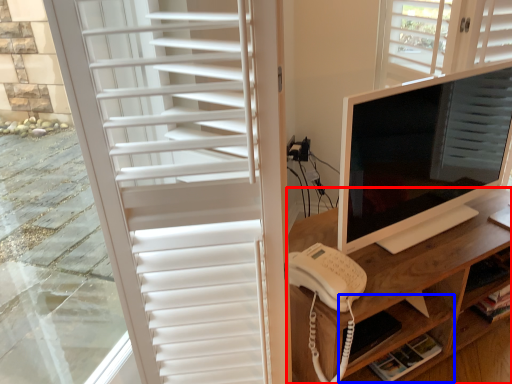
Question: Which point is further to the camera, desk (highlighted by a red box) or shelf (highlighted by a blue box)?

Choices:
 (A) desk
 (B) shelf

Answer: (B)